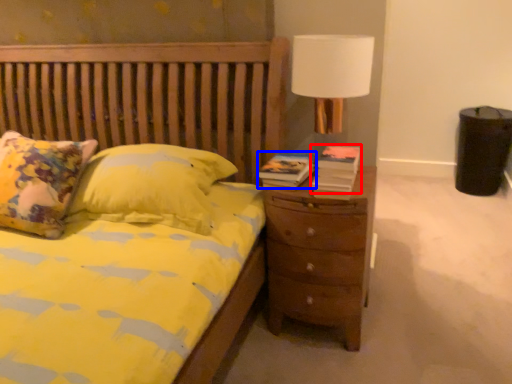
Question: Among these objects, which one is nearest to the camera, book (highlighted by a red box) or book (highlighted by a blue box)?

Choices:
 (A) book
 (B) book

Answer: (A)